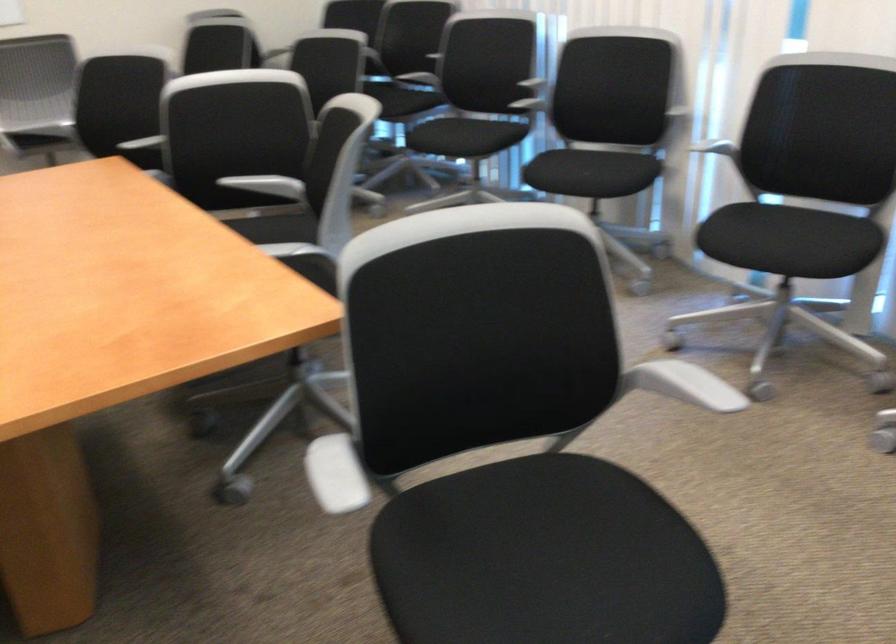
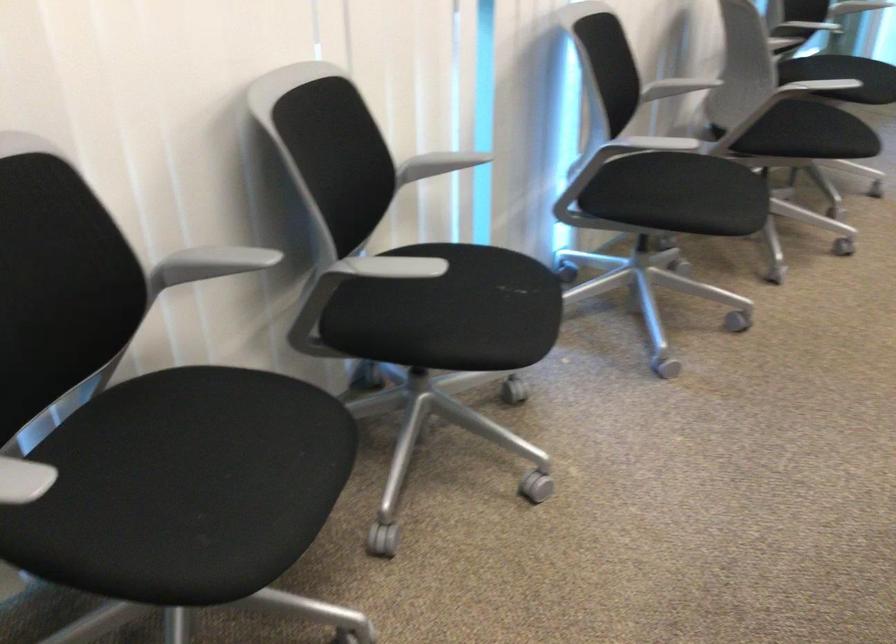
The point at (587, 178) is marked in the first image. Where is the corresponding point in the second image?

(515, 287)